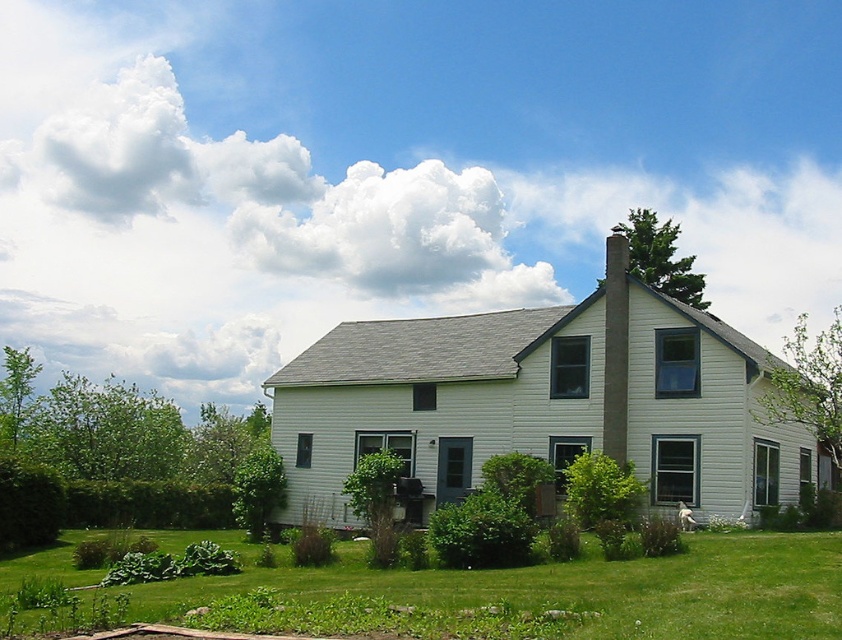
Identify the location of green grass at lower center. This screenshot has height=640, width=842. (579, 588).

In the scene shown: Is green grass at lower center positioned behind smooth concrete chimney at center?

No, it is not.

Who is more forward, (825, 614) or (617, 428)?

Point (825, 614) is more forward.

Locate an element on the screen. The height and width of the screenshot is (640, 842). green grass at lower center is located at coordinates (579, 588).